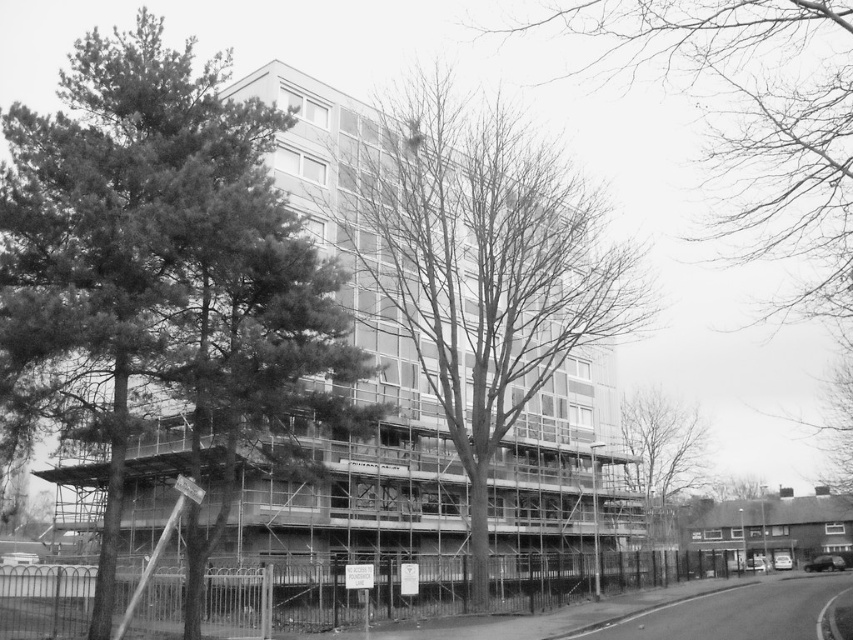
You are a construction worker standing at the entrance of the building. You need to check the distance between the green leafy tree at left and the bare branches at center. Which one is nearer to you?

The green leafy tree at left is closer to the viewer than the bare branches at center, so the green leafy tree at left is nearer to you.